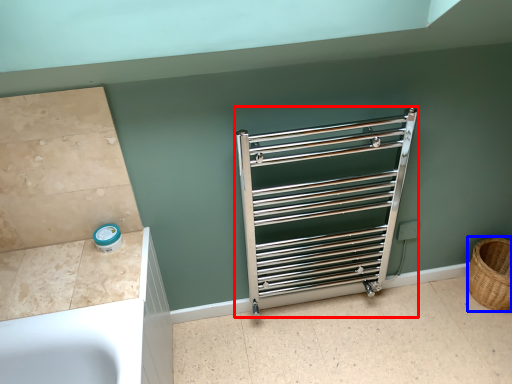
Question: Which point is closer to the camera, cage (highlighted by a red box) or basket (highlighted by a blue box)?

Choices:
 (A) cage
 (B) basket

Answer: (A)